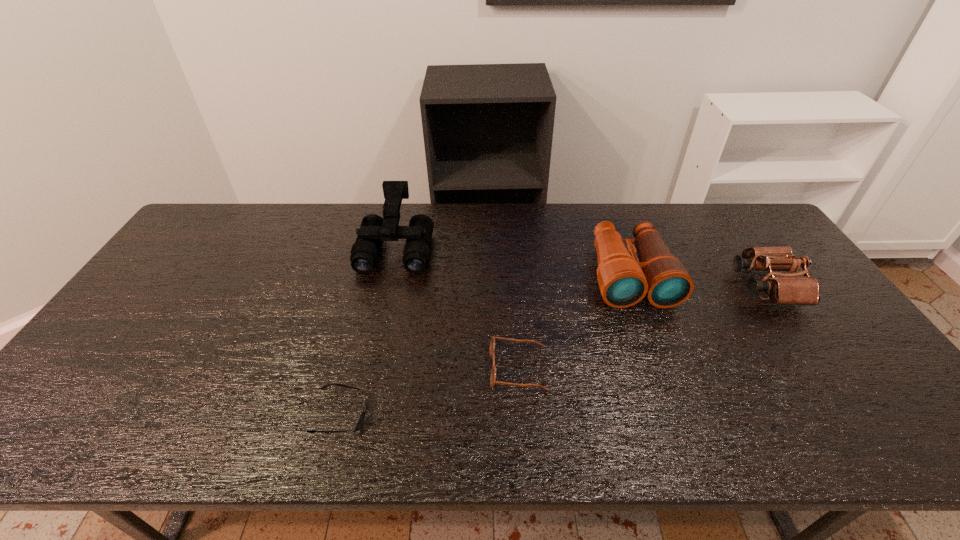
Where is `the leftmost binoculars`? The image size is (960, 540). the leftmost binoculars is located at coordinates (374, 229).

Locate an element on the screen. Image resolution: width=960 pixels, height=540 pixels. the tallest binoculars is located at coordinates (374, 229).

Identify the location of the fourth shortest object. (624, 281).

I want to click on the fourth object from left to right, so tap(624, 281).

This screenshot has height=540, width=960. I want to click on the rightmost object, so click(x=788, y=290).

Locate an element on the screen. This screenshot has width=960, height=540. the third tallest object is located at coordinates (788, 290).

Where is `the fourth tallest object`? The image size is (960, 540). the fourth tallest object is located at coordinates (492, 343).

Where is `spectacles`? This screenshot has height=540, width=960. spectacles is located at coordinates (492, 343).

Where is `sunglasses`? The height and width of the screenshot is (540, 960). sunglasses is located at coordinates (361, 419).

Locate an element on the screen. vacant space located 0.090m on the front lenses of the tallest object is located at coordinates (386, 297).